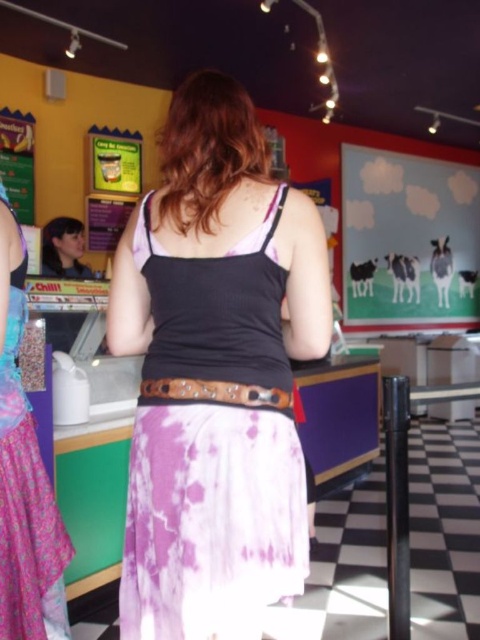
Who is taller, pastel paperboard at upper right or tie-dye fabric skirt at center?

pastel paperboard at upper right

Can you confirm if pastel paperboard at upper right is positioned to the right of tie-dye fabric skirt at center?

Yes, pastel paperboard at upper right is to the right of tie-dye fabric skirt at center.

Is point (442, 236) less distant than point (9, 589)?

No, (442, 236) is further to viewer.

Locate an element on the screen. pastel paperboard at upper right is located at coordinates (408, 241).

Which is above, pastel paperboard at upper right or brown leather belt at center?

pastel paperboard at upper right is above.

Is pastel paperboard at upper right to the left of brown leather belt at center from the viewer's perspective?

No, pastel paperboard at upper right is not to the left of brown leather belt at center.

Where is `pastel paperboard at upper right`? The image size is (480, 640). pastel paperboard at upper right is located at coordinates (408, 241).

Can you confirm if pastel paperboard at upper right is positioned below matte black hair at left?

No, pastel paperboard at upper right is not below matte black hair at left.

Is point (453, 262) positioned in front of point (56, 228)?

No, it is behind (56, 228).

What do you see at coordinates (408, 241) in the screenshot? This screenshot has height=640, width=480. I see `pastel paperboard at upper right` at bounding box center [408, 241].

Where is `pastel paperboard at upper right`? pastel paperboard at upper right is located at coordinates (408, 241).